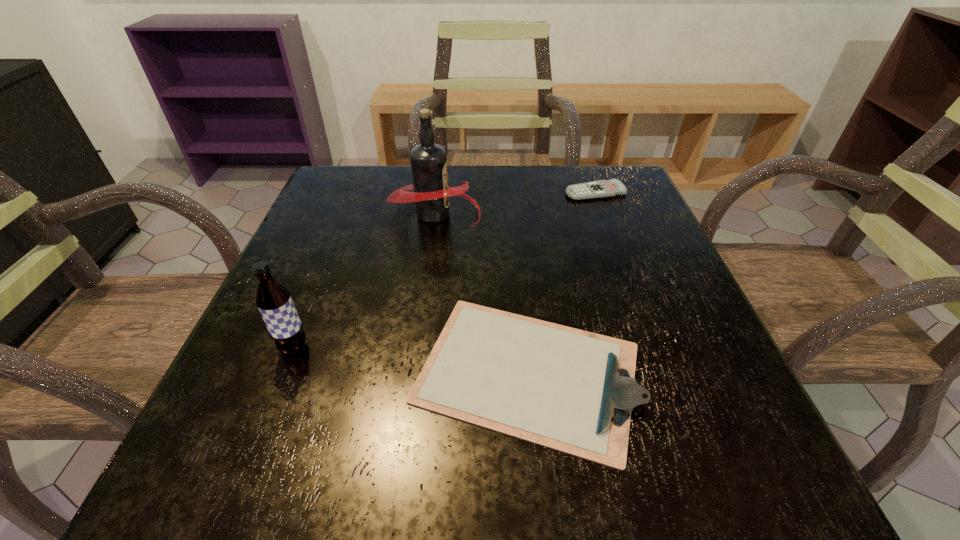
I want to click on the taller root beer, so click(x=431, y=194).

Image resolution: width=960 pixels, height=540 pixels. Identify the location of the tallest object. (431, 194).

This screenshot has width=960, height=540. I want to click on the shorter root beer, so click(x=273, y=299).

You are a GUI agent. You are given a task and a screenshot of the screen. Output one action in this format:
    pyautogui.click(x=<x>, y=<y>)
    Task: Click on the left root beer
    This screenshot has height=540, width=960.
    Given the screenshot: What is the action you would take?
    pyautogui.click(x=273, y=299)

Where is `the second shortest object`? This screenshot has width=960, height=540. the second shortest object is located at coordinates (567, 389).

Where is `remote control`? remote control is located at coordinates (599, 189).

Identify the location of free region located on the label of the tallest object. (517, 214).

This screenshot has width=960, height=540. Identify the location of vacant region located on the back of the leftmost object. (348, 212).

Find the location of a particular element. vacant space located on the left of the third tallest object is located at coordinates (364, 373).

Find the location of `vacant space situated 0.050m on the back of the shortest object`. vacant space situated 0.050m on the back of the shortest object is located at coordinates (588, 173).